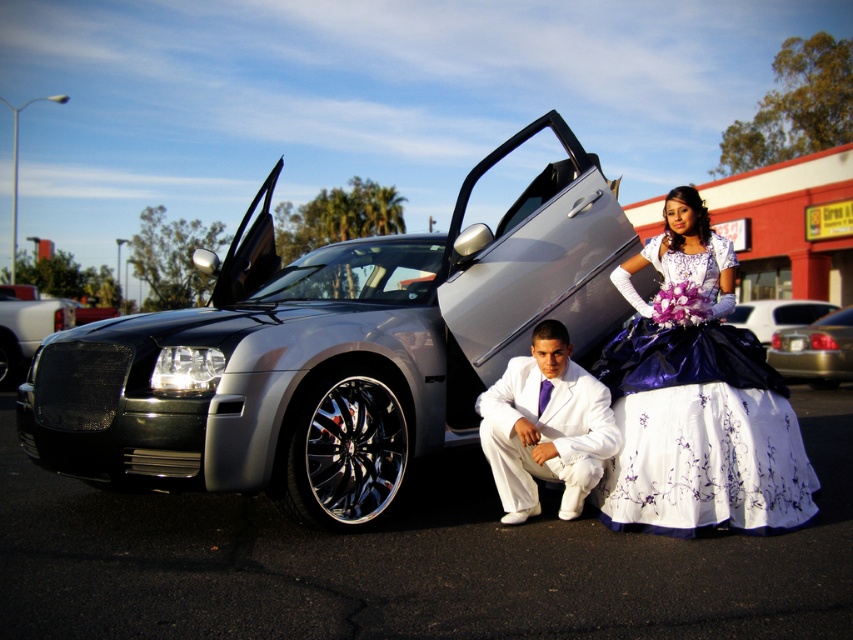
Question: Which of the following is the closest to the observer?

Choices:
 (A) white satin suit at center
 (B) shiny chrome grille at center
 (C) silver metallic sedan at center

Answer: (A)

Question: Which object is positioned closest to the white satin suit at center?

Choices:
 (A) shiny chrome grille at center
 (B) satin silver car at center
 (C) silver metallic sedan at center

Answer: (C)

Question: Is shiny chrome grille at center above silver metallic sedan at lower right?

Choices:
 (A) no
 (B) yes

Answer: (B)

Question: Is matte purple satin dress at right below shiny chrome grille at center?

Choices:
 (A) yes
 (B) no

Answer: (A)

Question: Is satin silver car at center positioned at the back of white satin suit at center?

Choices:
 (A) no
 (B) yes

Answer: (A)

Question: Which of the following is the closest to the observer?

Choices:
 (A) silver metallic sedan at center
 (B) shiny chrome grille at center
 (C) satin silver car at center

Answer: (C)